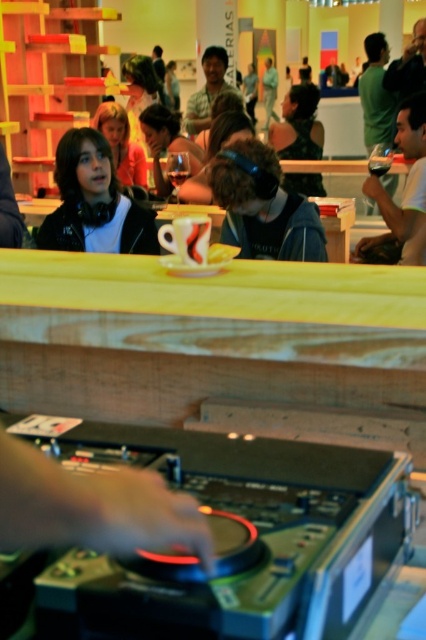
You are standing at the DJ setup and want to move towards the wooden counter. Which point, point (321, 253) or point (118, 205), is closer to you as you move towards the counter?

Point (321, 253) is closer to the camera than point (118, 205), so it is the closer point as you move towards the wooden counter.

You are organizing a small concert and need to place two speakers between the matte black headphones at upper left and the matte black headphones at upper right. The speakers are 1.2 meters wide. Will they fit in the space between them?

The distance between the matte black headphones at upper left and the matte black headphones at upper right is 1.43 meters. Since the speakers are 1.2 meters wide, they will fit as there is enough space between the headphones.